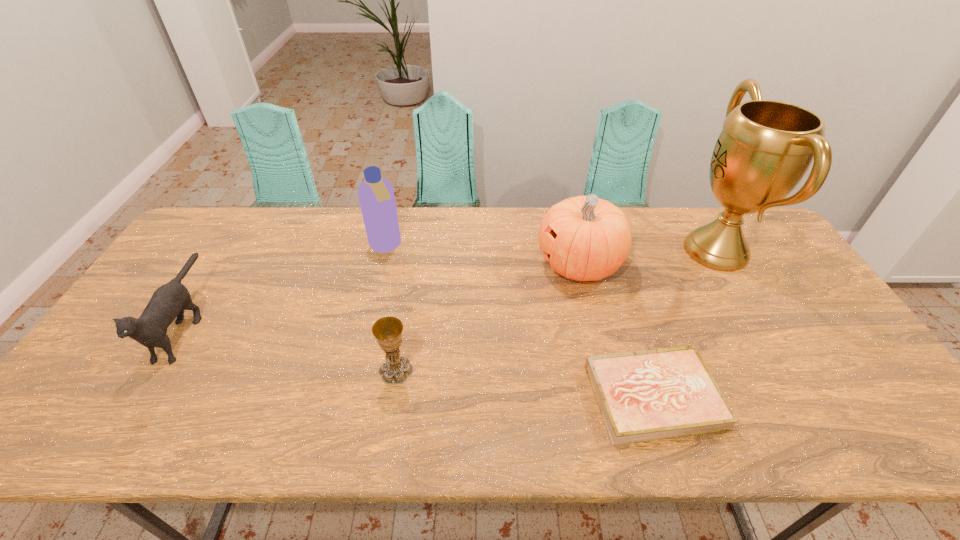
Image resolution: width=960 pixels, height=540 pixels. I want to click on free area in between the shortest object and the pumpkin, so click(x=616, y=330).

Where is `blank region between the pumpkin and the cat`? blank region between the pumpkin and the cat is located at coordinates (383, 294).

This screenshot has height=540, width=960. I want to click on free spot between the shortest object and the second object from left to right, so click(x=519, y=321).

The image size is (960, 540). I want to click on free spot between the shampoo and the pumpkin, so click(x=483, y=255).

Locate an element on the screen. This screenshot has width=960, height=540. unoccupied position between the fourth object from right to left and the tallest object is located at coordinates (556, 310).

Locate an element on the screen. free space between the cat and the rightmost object is located at coordinates (451, 287).

The height and width of the screenshot is (540, 960). I want to click on object that is the fifth closest to the pumpkin, so click(x=169, y=301).

You are a GUI agent. You are given a task and a screenshot of the screen. Output one action in this format:
    pyautogui.click(x=<x>, y=<y>)
    Task: Click on the object that can be found as the second closest to the pumpkin
    
    Given the screenshot: What is the action you would take?
    pyautogui.click(x=647, y=395)

You are a GUI agent. You are given a task and a screenshot of the screen. Output one action in this format:
    pyautogui.click(x=<x>, y=<y>)
    Task: Click on the blank area in the image that satisfies the following two spatial constraints: 1. on the front-facing side of the pumpkin; 2. on the front side of the third object from left to right
    The height and width of the screenshot is (540, 960).
    Given the screenshot: What is the action you would take?
    pyautogui.click(x=605, y=370)

This screenshot has height=540, width=960. Identify the location of vacant space that satisfies the following two spatial constraints: 1. on the front-facing side of the pumpkin; 2. on the front-facing side of the leftmost object. (594, 325).